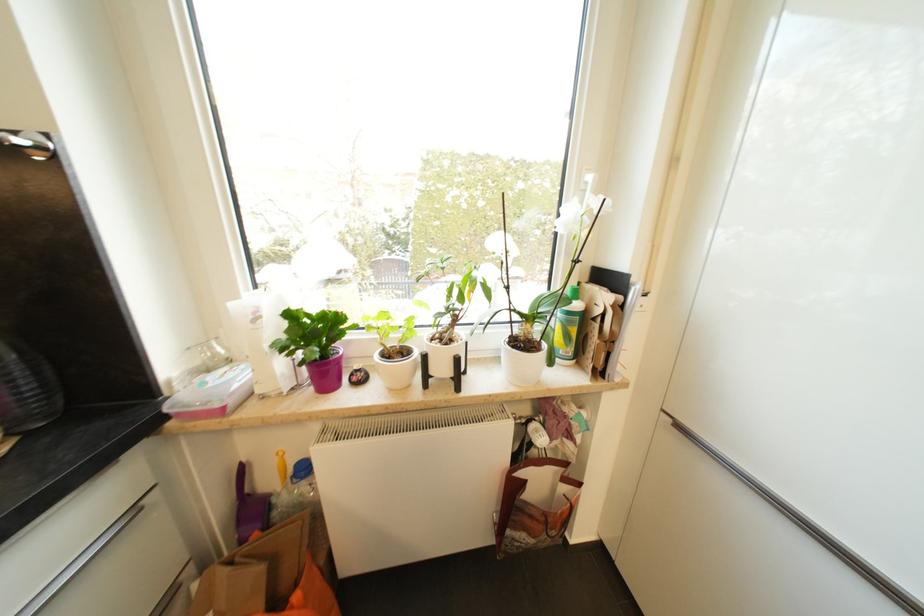
Where would you pull the silver refrigerator handle? Please return your answer as a coordinate pair (x, y).

(755, 485)